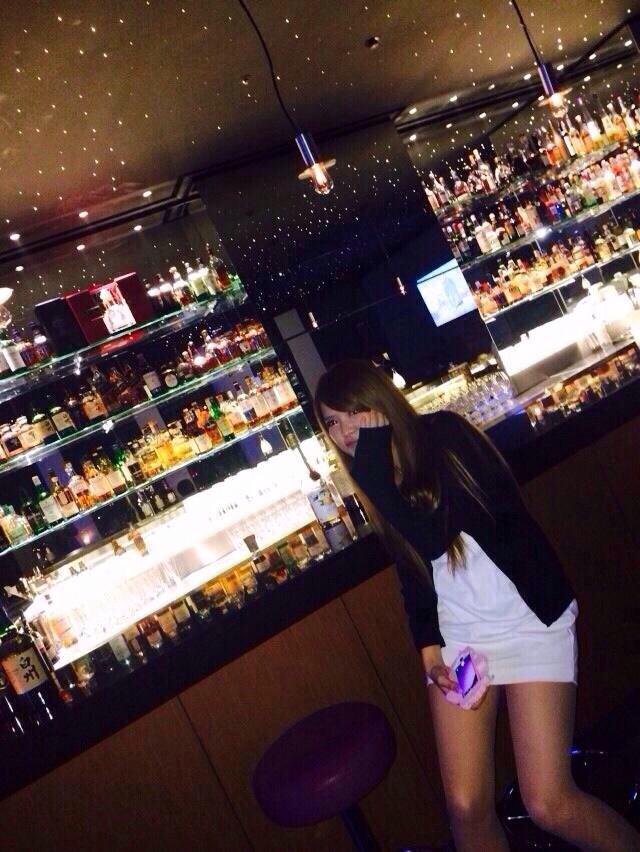
Image resolution: width=640 pixels, height=852 pixels. I want to click on phone, so click(x=463, y=676).